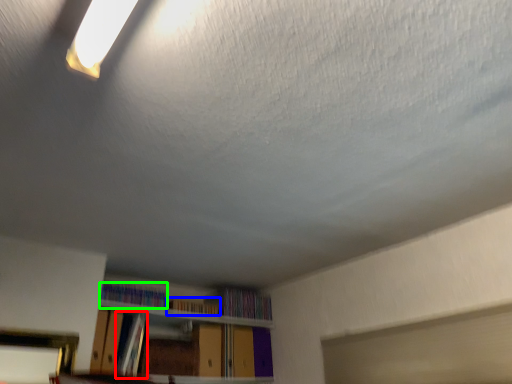
Question: Which object is positioned farthest from book (highlighted by a red box)? Select from book (highlighted by a blue box) and book (highlighted by a green box).

Choices:
 (A) book
 (B) book

Answer: (A)